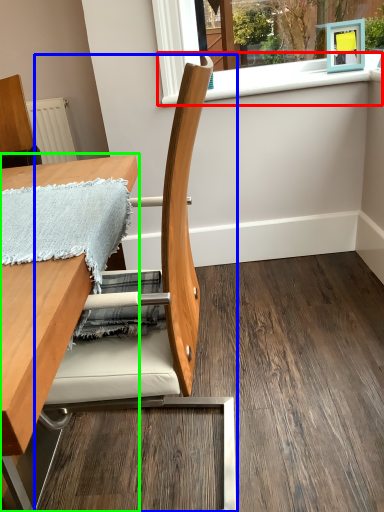
Question: Considering the real-world distances, which object is closest to window sill (highlighted by a red box)? chair (highlighted by a blue box) or table (highlighted by a green box).

Choices:
 (A) chair
 (B) table

Answer: (B)